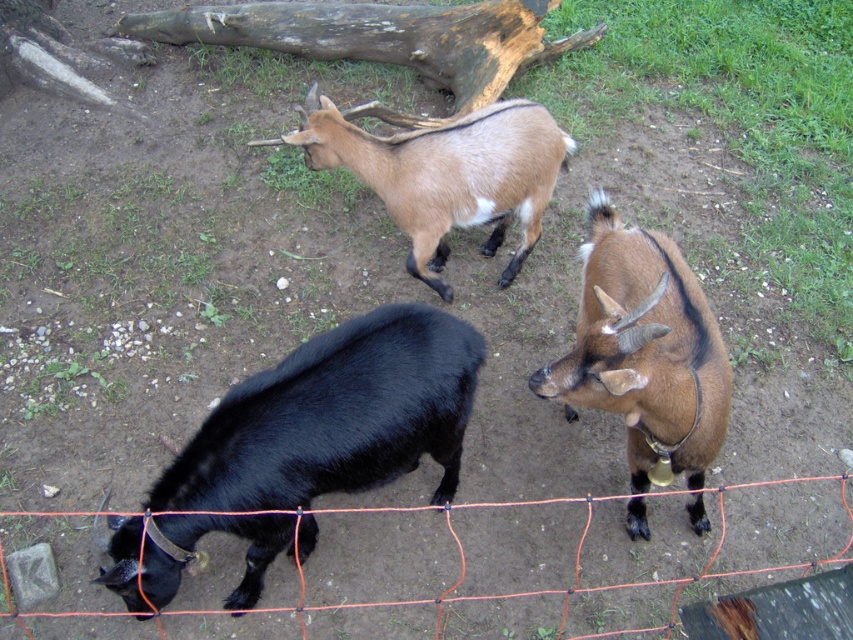
You are a farmer who needs to move the black glossy goat at lower left closer to the brown weathered log at upper center. Given that the goat can move freely within the enclosure, what is the minimum distance the goat must travel to reach the log?

The minimum distance the black glossy goat at lower left must travel to reach the brown weathered log at upper center is 2.42 meters.

You are a farmer checking the enclosure. You need to move the black glossy goat at lower left to a different pen. To do this, you must first ensure there is enough space between the goat and the brown weathered log at upper center. Is there sufficient space for the goat to move freely without bumping into the log?

The black glossy goat at lower left has a smaller size compared to the brown weathered log at upper center. Since the goat is smaller, there should be enough space for it to move freely without bumping into the log.